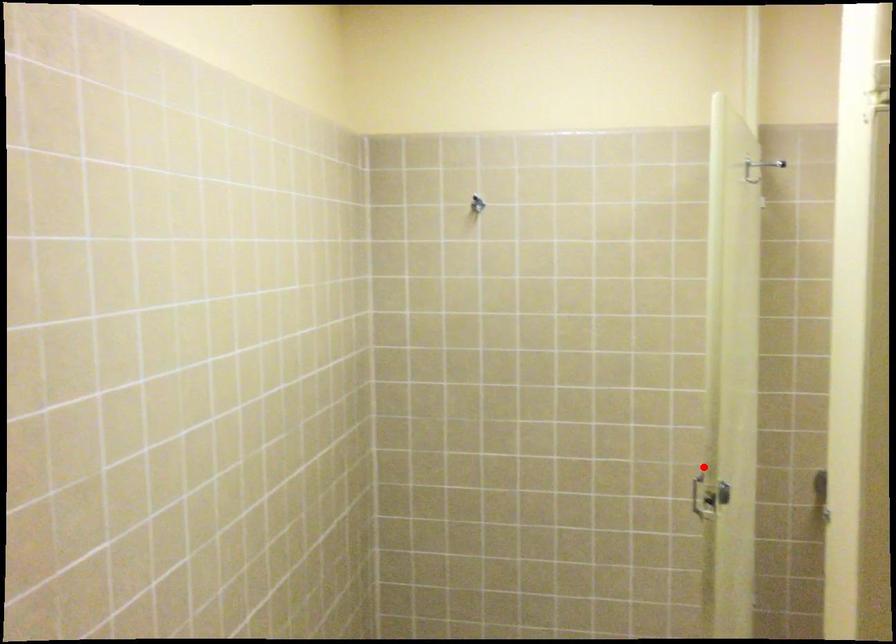
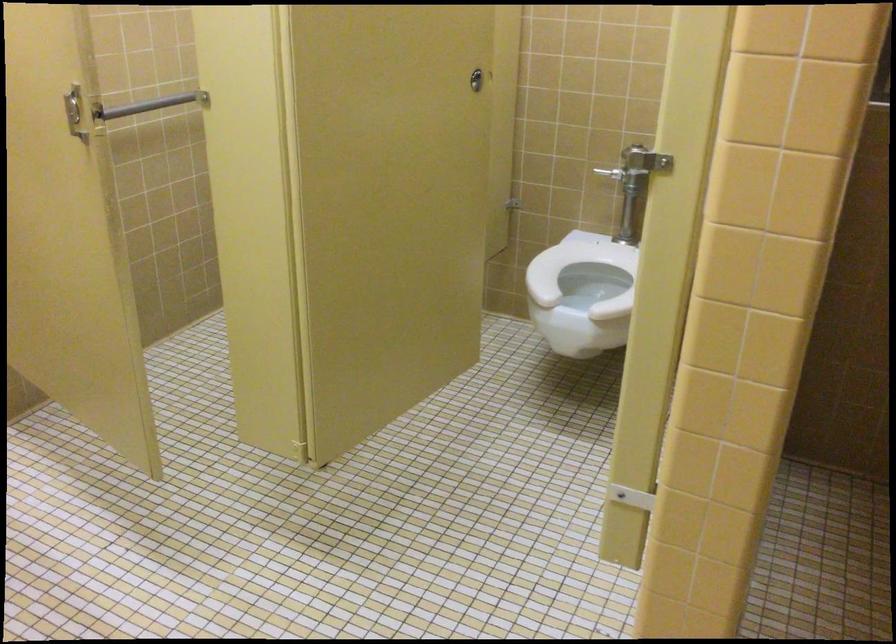
Question: I am providing you with two images of the same scene from different viewpoints. Image1 has a red point marked. In image2, the corresponding 3D location appears at what relative position? Reply with the corresponding letter.

Choices:
 (A) Closer
 (B) Farther

Answer: (A)